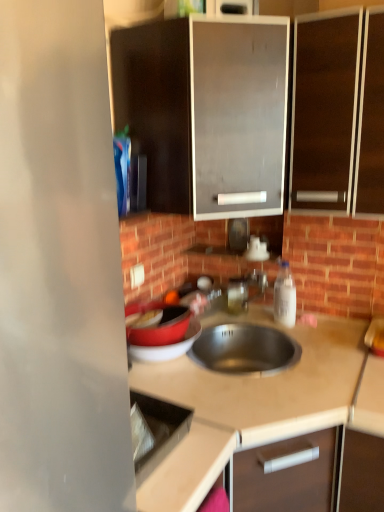
Question: Is the position of white plastic electric outlet at upper center more distant than that of dark wood cabinet at upper right, the second cabinetry viewed from the left?

Choices:
 (A) no
 (B) yes

Answer: (B)

Question: From a real-world perspective, is white plastic electric outlet at upper center positioned under dark wood cabinet at upper right, the first cabinetry from the right, based on gravity?

Choices:
 (A) no
 (B) yes

Answer: (B)

Question: Can you see white plastic electric outlet at upper center touching dark wood cabinet at upper right, the second cabinetry viewed from the left?

Choices:
 (A) yes
 (B) no

Answer: (B)

Question: Can you confirm if white plastic electric outlet at upper center is taller than dark wood cabinet at upper right, the second cabinetry viewed from the left?

Choices:
 (A) yes
 (B) no

Answer: (B)

Question: Considering the relative positions of white plastic electric outlet at upper center and dark wood cabinet at upper right, the first cabinetry from the right, in the image provided, is white plastic electric outlet at upper center to the left of dark wood cabinet at upper right, the first cabinetry from the right, from the viewer's perspective?

Choices:
 (A) yes
 (B) no

Answer: (A)

Question: Can you confirm if white plastic electric outlet at upper center is wider than dark wood cabinet at upper right, the second cabinetry viewed from the left?

Choices:
 (A) no
 (B) yes

Answer: (A)

Question: From a real-world perspective, is matte black cabinet at upper center, which is the 1th cabinetry in left-to-right order, positioned over beige laminate countertop at center based on gravity?

Choices:
 (A) yes
 (B) no

Answer: (A)

Question: Considering the relative sizes of matte black cabinet at upper center, which is the 1th cabinetry in left-to-right order, and beige laminate countertop at center in the image provided, is matte black cabinet at upper center, which is the 1th cabinetry in left-to-right order, thinner than beige laminate countertop at center?

Choices:
 (A) yes
 (B) no

Answer: (A)

Question: Does matte black cabinet at upper center, the second cabinetry from the right, have a smaller size compared to beige laminate countertop at center?

Choices:
 (A) yes
 (B) no

Answer: (A)

Question: Considering the relative sizes of matte black cabinet at upper center, the second cabinetry from the right, and beige laminate countertop at center in the image provided, is matte black cabinet at upper center, the second cabinetry from the right, shorter than beige laminate countertop at center?

Choices:
 (A) yes
 (B) no

Answer: (A)

Question: Does matte black cabinet at upper center, the second cabinetry from the right, have a greater height compared to beige laminate countertop at center?

Choices:
 (A) no
 (B) yes

Answer: (A)

Question: Is matte black cabinet at upper center, which is the 1th cabinetry in left-to-right order, not near beige laminate countertop at center?

Choices:
 (A) yes
 (B) no

Answer: (B)

Question: Considering the relative sizes of white plastic electric outlet at upper center and white plastic bottle at right in the image provided, is white plastic electric outlet at upper center taller than white plastic bottle at right?

Choices:
 (A) yes
 (B) no

Answer: (B)